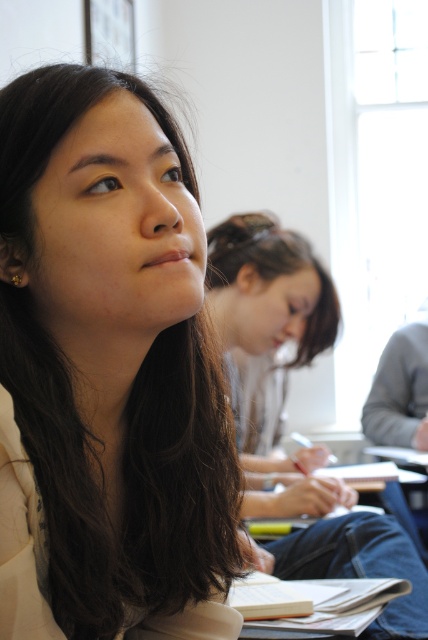
You are standing in the classroom and want to move from the point at coordinates (165, 259) to the point at coordinates (237, 432). Is the destination point behind or in front of the starting point from your perspective?

The point at coordinates (237, 432) is behind the point at coordinates (165, 259) because the starting point is in front of the destination point according to their spatial relationship.

In the classroom scene, you notice the matte beige shirt at upper left and the smooth brown hair at center. Which object takes up more space in the image?

The smooth brown hair at center takes up more space in the image because the matte beige shirt at upper left is smaller than smooth brown hair at center.

You are a photographer trying to capture a candid shot of the matte beige shirt at upper left and the smooth brown hair at center. Which object should you frame first if you want to include both in your shot?

The matte beige shirt at upper left should be framed first since it is positioned on the left side of the smooth brown hair at center, allowing both to be included in the shot.